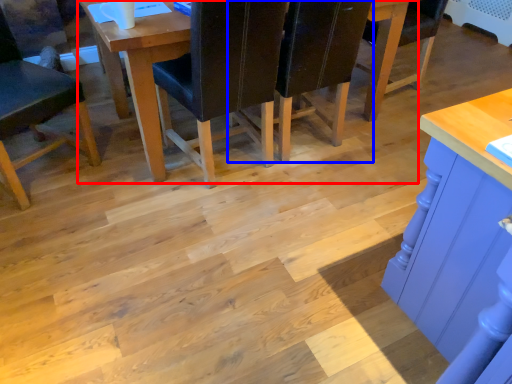
Question: Among these objects, which one is nearest to the camera, table (highlighted by a red box) or chair (highlighted by a blue box)?

Choices:
 (A) table
 (B) chair

Answer: (A)